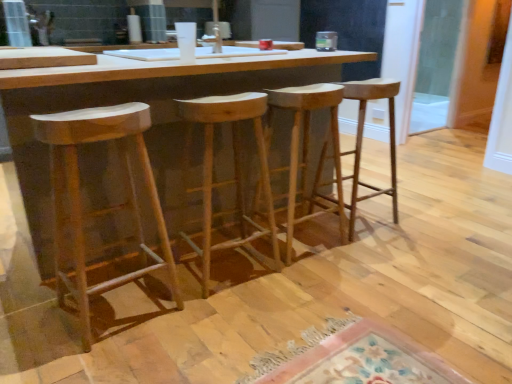
In order to click on vacant space underneath natural wood stool at left, the 1th stool from the left (from a real-world perspective) in this screenshot , I will do `click(124, 307)`.